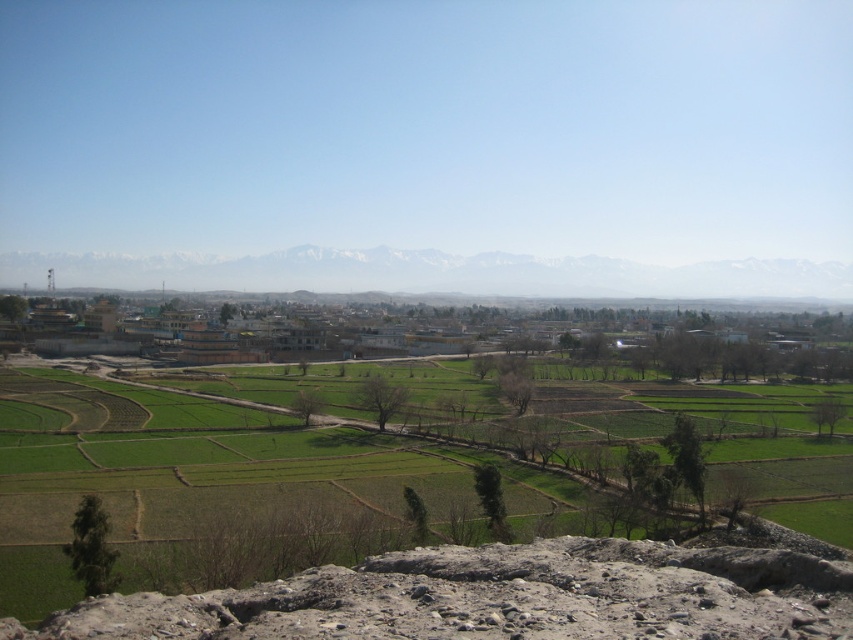
Can you confirm if green grassland at center is thinner than snowy white mountain at upper center?

Indeed, green grassland at center has a lesser width compared to snowy white mountain at upper center.

What do you see at coordinates (509, 595) in the screenshot? I see `green grassland at center` at bounding box center [509, 595].

Is point (764, 588) positioned behind point (410, 259)?

No.

The image size is (853, 640). I want to click on green grassland at center, so click(x=509, y=595).